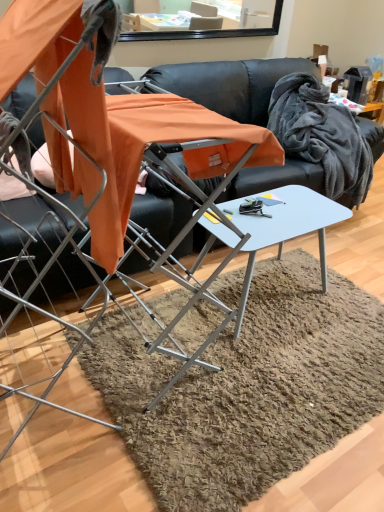
Question: Does white glossy table at center turn towards metallic silver folding chair at center?

Choices:
 (A) yes
 (B) no

Answer: (B)

Question: Is white glossy table at center touching metallic silver folding chair at center?

Choices:
 (A) yes
 (B) no

Answer: (B)

Question: Is white glossy table at center positioned beyond the bounds of metallic silver folding chair at center?

Choices:
 (A) yes
 (B) no

Answer: (A)

Question: From the image's perspective, would you say white glossy table at center is shown under metallic silver folding chair at center?

Choices:
 (A) no
 (B) yes

Answer: (B)

Question: Can you confirm if white glossy table at center is smaller than metallic silver folding chair at center?

Choices:
 (A) yes
 (B) no

Answer: (A)

Question: Considering the relative sizes of white glossy table at center and metallic silver folding chair at center in the image provided, is white glossy table at center bigger than metallic silver folding chair at center?

Choices:
 (A) yes
 (B) no

Answer: (B)

Question: Is black leather couch at center oriented away from gray fluffy blanket at upper right?

Choices:
 (A) yes
 (B) no

Answer: (A)

Question: From a real-world perspective, is black leather couch at center beneath gray fluffy blanket at upper right?

Choices:
 (A) yes
 (B) no

Answer: (A)

Question: Considering the relative positions of black leather couch at center and gray fluffy blanket at upper right in the image provided, is black leather couch at center to the left of gray fluffy blanket at upper right from the viewer's perspective?

Choices:
 (A) yes
 (B) no

Answer: (A)

Question: From the image's perspective, would you say black leather couch at center is shown under gray fluffy blanket at upper right?

Choices:
 (A) no
 (B) yes

Answer: (B)

Question: Can you confirm if black leather couch at center is taller than gray fluffy blanket at upper right?

Choices:
 (A) no
 (B) yes

Answer: (B)

Question: Is black leather couch at center further to the viewer compared to gray fluffy blanket at upper right?

Choices:
 (A) yes
 (B) no

Answer: (B)

Question: Is black leather couch at center behind metallic silver folding chair at center?

Choices:
 (A) no
 (B) yes

Answer: (B)